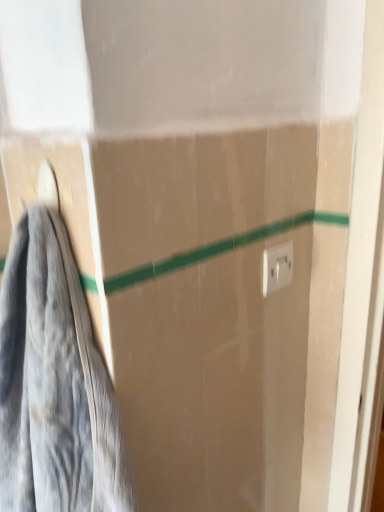
The image size is (384, 512). Identify the location of gray fabric towel at left. (54, 384).

What is the approximate width of gray fabric towel at left?

gray fabric towel at left is 1.08 inches in width.

The image size is (384, 512). Describe the element at coordinates (54, 384) in the screenshot. I see `gray fabric towel at left` at that location.

The width and height of the screenshot is (384, 512). Describe the element at coordinates (277, 267) in the screenshot. I see `white plastic electric outlet at upper right` at that location.

In order to face white plastic electric outlet at upper right, should I rotate leftwards or rightwards?

To face it directly, rotate right by 11.970 degrees.

What is the approximate height of white plastic electric outlet at upper right?

It is 3.24 inches.

What is the approximate width of white plastic electric outlet at upper right?

It is 1.36 centimeters.

This screenshot has width=384, height=512. I want to click on white plastic electric outlet at upper right, so click(x=277, y=267).

Identify the location of gray fabric towel at left. (54, 384).

Which object is positioned more to the right, white plastic electric outlet at upper right or gray fabric towel at left?

Positioned to the right is white plastic electric outlet at upper right.

Which object is further away from the camera taking this photo, white plastic electric outlet at upper right or gray fabric towel at left?

white plastic electric outlet at upper right is further away from the camera.

Which is nearer, (277, 271) or (81, 509)?

Point (277, 271) appears to be farther away from the viewer than point (81, 509).

From the image's perspective, is white plastic electric outlet at upper right located above gray fabric towel at left?

Correct, white plastic electric outlet at upper right appears higher than gray fabric towel at left in the image.

From a real-world perspective, which is physically above, white plastic electric outlet at upper right or gray fabric towel at left?

From a 3D spatial view, white plastic electric outlet at upper right is above.

Can you confirm if white plastic electric outlet at upper right is thinner than gray fabric towel at left?

Indeed, white plastic electric outlet at upper right has a lesser width compared to gray fabric towel at left.

Considering the sizes of objects white plastic electric outlet at upper right and gray fabric towel at left in the image provided, who is taller, white plastic electric outlet at upper right or gray fabric towel at left?

gray fabric towel at left is taller.

Which of these two, white plastic electric outlet at upper right or gray fabric towel at left, is smaller?

white plastic electric outlet at upper right.

Would you say white plastic electric outlet at upper right is inside or outside gray fabric towel at left?

white plastic electric outlet at upper right is located beyond the bounds of gray fabric towel at left.

Is white plastic electric outlet at upper right directly adjacent to gray fabric towel at left?

No, white plastic electric outlet at upper right is not making contact with gray fabric towel at left.

Is white plastic electric outlet at upper right oriented away from gray fabric towel at left?

No, white plastic electric outlet at upper right is not facing the opposite direction of gray fabric towel at left.

How different are the orientations of white plastic electric outlet at upper right and gray fabric towel at left in degrees?

white plastic electric outlet at upper right and gray fabric towel at left are facing 92 degrees away from each other.

What are the coordinates of `electric outlet on the right of gray fabric towel at left` in the screenshot? It's located at (277, 267).

Considering the relative positions of gray fabric towel at left and white plastic electric outlet at upper right in the image provided, is gray fabric towel at left to the left or to the right of white plastic electric outlet at upper right?

In the image, gray fabric towel at left appears on the left side of white plastic electric outlet at upper right.

Is gray fabric towel at left further to camera compared to white plastic electric outlet at upper right?

No, gray fabric towel at left is closer to the viewer.

Is point (56, 444) positioned in front of point (279, 273)?

Yes, it is.

From the image's perspective, is gray fabric towel at left positioned above or below white plastic electric outlet at upper right?

Clearly, from the image's perspective, gray fabric towel at left is below white plastic electric outlet at upper right.

Consider the image. From a real-world perspective, is gray fabric towel at left positioned under white plastic electric outlet at upper right based on gravity?

Yes, from a real-world perspective, gray fabric towel at left is under white plastic electric outlet at upper right.

Which object is thinner, gray fabric towel at left or white plastic electric outlet at upper right?

With smaller width is white plastic electric outlet at upper right.

Considering the relative sizes of gray fabric towel at left and white plastic electric outlet at upper right in the image provided, is gray fabric towel at left shorter than white plastic electric outlet at upper right?

No, gray fabric towel at left is not shorter than white plastic electric outlet at upper right.

Which of these two, gray fabric towel at left or white plastic electric outlet at upper right, is smaller?

white plastic electric outlet at upper right.

Do you think gray fabric towel at left is within white plastic electric outlet at upper right, or outside of it?

gray fabric towel at left exists outside the volume of white plastic electric outlet at upper right.

Is gray fabric towel at left positioned far away from white plastic electric outlet at upper right?

No, there isn't a large distance between gray fabric towel at left and white plastic electric outlet at upper right.

Is gray fabric towel at left aimed at white plastic electric outlet at upper right?

No, gray fabric towel at left is not facing towards white plastic electric outlet at upper right.

How many degrees apart are the facing directions of gray fabric towel at left and white plastic electric outlet at upper right?

They differ by 92 degrees in their facing directions.

Measure the distance from gray fabric towel at left to white plastic electric outlet at upper right.

They are 37.18 centimeters apart.

The image size is (384, 512). I want to click on towel below the white plastic electric outlet at upper right (from the image's perspective), so click(x=54, y=384).

Locate an element on the screen. This screenshot has width=384, height=512. electric outlet above the gray fabric towel at left (from the image's perspective) is located at coordinates (277, 267).

Image resolution: width=384 pixels, height=512 pixels. In order to click on towel in front of the white plastic electric outlet at upper right in this screenshot , I will do `click(54, 384)`.